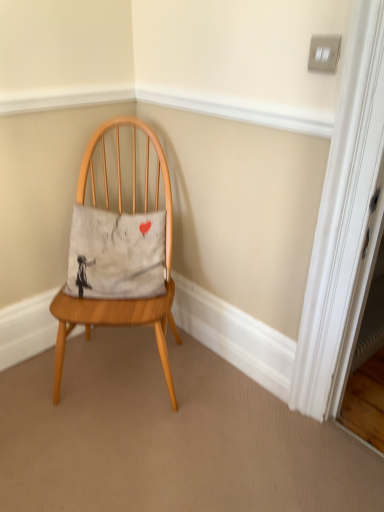
Describe the element at coordinates (122, 300) in the screenshot. This screenshot has width=384, height=512. I see `wooden chair at center` at that location.

Image resolution: width=384 pixels, height=512 pixels. I want to click on wooden chair at center, so click(x=122, y=300).

Image resolution: width=384 pixels, height=512 pixels. What do you see at coordinates (116, 254) in the screenshot? I see `white cotton pillow at center` at bounding box center [116, 254].

You are a GUI agent. You are given a task and a screenshot of the screen. Output one action in this format:
    pyautogui.click(x=<x>, y=<y>)
    Task: Click on the white cotton pillow at center
    Image resolution: width=384 pixels, height=512 pixels.
    Given the screenshot: What is the action you would take?
    (x=116, y=254)

This screenshot has height=512, width=384. Find the location of `wooden chair at center`. wooden chair at center is located at coordinates (122, 300).

Between wooden chair at center and white cotton pillow at center, which one appears on the right side from the viewer's perspective?

wooden chair at center.

Considering the positions of objects wooden chair at center and white cotton pillow at center in the image provided, who is in front, wooden chair at center or white cotton pillow at center?

wooden chair at center is in front.

Is point (156, 177) less distant than point (91, 241)?

No.

From the image's perspective, does wooden chair at center appear lower than white cotton pillow at center?

Yes.

From a real-world perspective, is wooden chair at center below white cotton pillow at center?

Yes, from a real-world perspective, wooden chair at center is beneath white cotton pillow at center.

Which of these two, wooden chair at center or white cotton pillow at center, is wider?

wooden chair at center.

Considering the relative sizes of wooden chair at center and white cotton pillow at center in the image provided, is wooden chair at center taller than white cotton pillow at center?

Yes, wooden chair at center is taller than white cotton pillow at center.

Based on the photo, does wooden chair at center have a smaller size compared to white cotton pillow at center?

No.

Choose the correct answer: Is wooden chair at center inside white cotton pillow at center or outside it?

wooden chair at center is spatially situated outside white cotton pillow at center.

Is wooden chair at center far away from white cotton pillow at center?

wooden chair at center is near white cotton pillow at center, not far away.

Is wooden chair at center turned away from white cotton pillow at center?

Correct, wooden chair at center is looking away from white cotton pillow at center.

How different are the orientations of wooden chair at center and white cotton pillow at center in degrees?

The facing directions of wooden chair at center and white cotton pillow at center are 1.88 degrees apart.

Where is `pillow above the wooden chair at center (from a real-world perspective)`? pillow above the wooden chair at center (from a real-world perspective) is located at coordinates (116, 254).

Is white cotton pillow at center at the right side of wooden chair at center?

In fact, white cotton pillow at center is to the left of wooden chair at center.

Is white cotton pillow at center in front of or behind wooden chair at center in the image?

In the image, white cotton pillow at center appears behind wooden chair at center.

Does point (124, 274) come behind point (161, 147)?

That is False.

From the image's perspective, is white cotton pillow at center under wooden chair at center?

No, from the image's perspective, white cotton pillow at center is not below wooden chair at center.

In the scene shown: From a real-world perspective, between white cotton pillow at center and wooden chair at center, who is vertically higher?

From a 3D spatial view, white cotton pillow at center is above.

Considering the sizes of white cotton pillow at center and wooden chair at center in the image, is white cotton pillow at center wider or thinner than wooden chair at center?

In the image, white cotton pillow at center appears to be more narrow than wooden chair at center.

Based on the photo, is white cotton pillow at center taller or shorter than wooden chair at center?

white cotton pillow at center is shorter than wooden chair at center.

Which of these two, white cotton pillow at center or wooden chair at center, is bigger?

wooden chair at center.

Is white cotton pillow at center inside the boundaries of wooden chair at center, or outside?

white cotton pillow at center is enclosed within wooden chair at center.

Is white cotton pillow at center next to wooden chair at center and touching it?

No, white cotton pillow at center is not touching wooden chair at center.

Could you tell me if white cotton pillow at center is turned towards wooden chair at center?

Yes, white cotton pillow at center faces towards wooden chair at center.

This screenshot has width=384, height=512. Identify the location of chair below the white cotton pillow at center (from a real-world perspective). pos(122,300).

Locate an element on the screen. This screenshot has width=384, height=512. pillow above the wooden chair at center (from the image's perspective) is located at coordinates (116, 254).

What are the coordinates of `chair below the white cotton pillow at center (from the image's perspective)` in the screenshot? It's located at (122, 300).